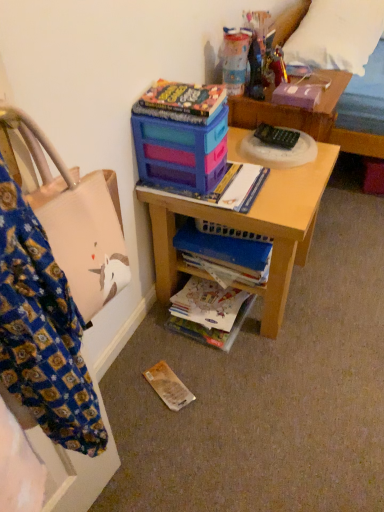
I want to click on vacant area in front of wooden desk at center, so click(245, 385).